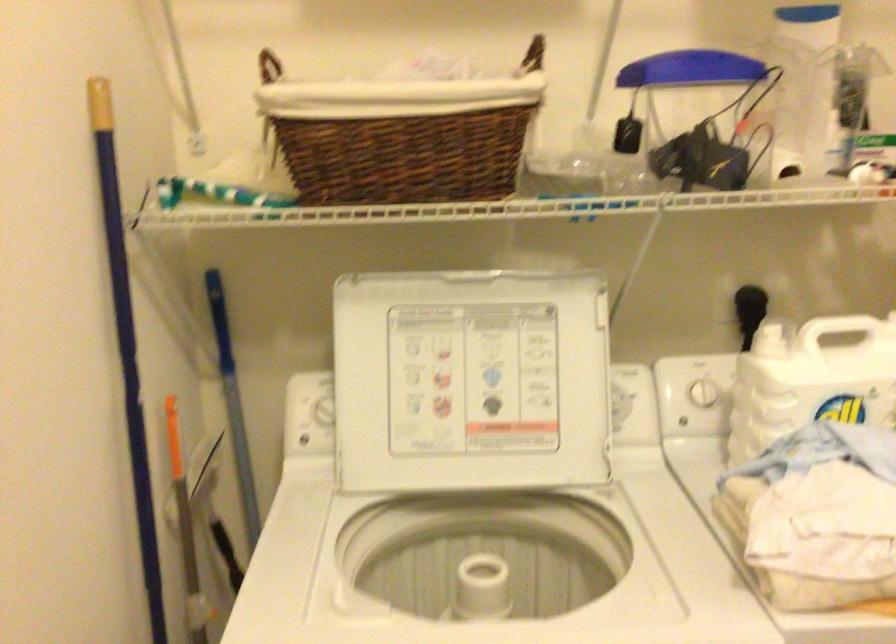
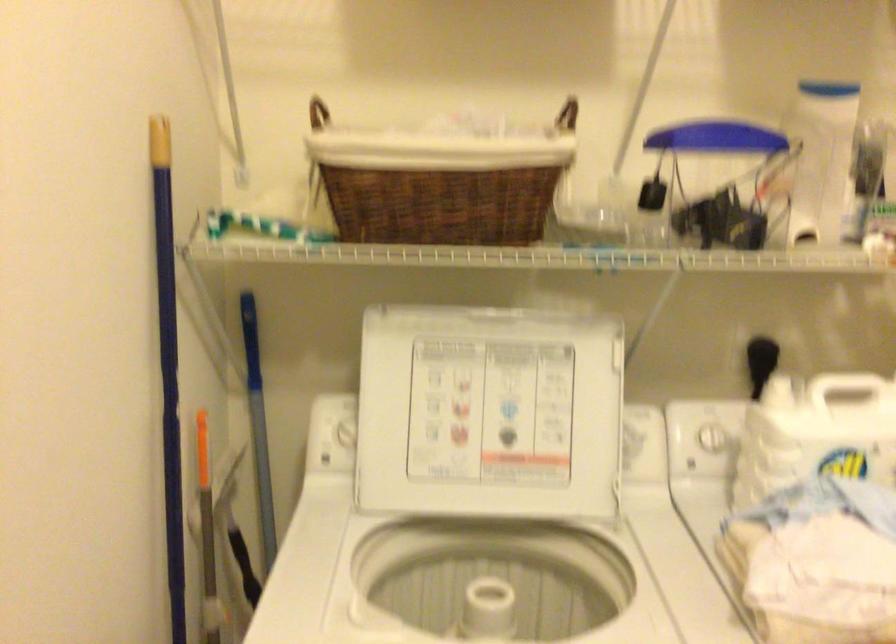
Question: How did the camera likely rotate?

Choices:
 (A) Left
 (B) Right
 (C) Up
 (D) Down

Answer: (C)